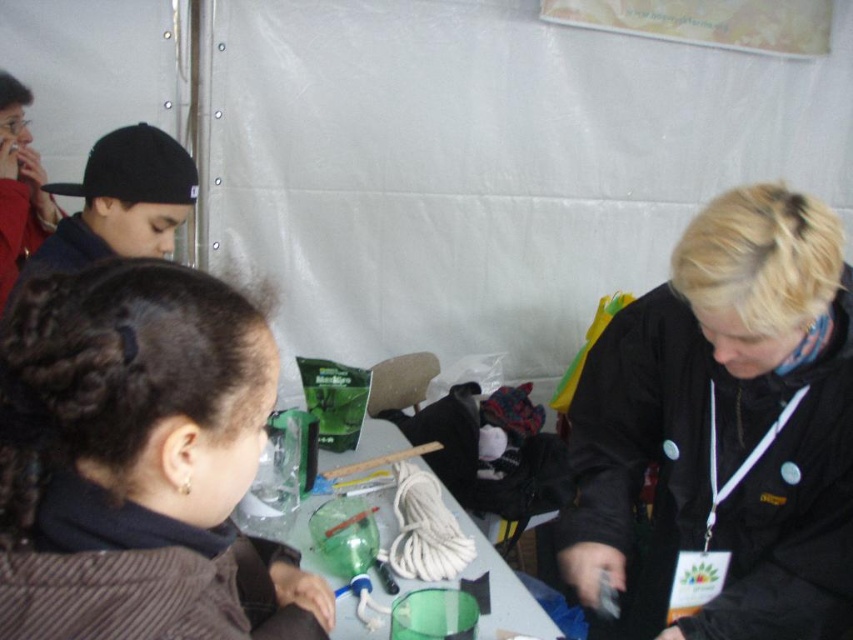
You are organizing a fashion show and need to display the black matte jacket at upper right and the black matte cap at upper left. Which item will require more horizontal space when placed side by side on a display stand?

The black matte jacket at upper right requires more horizontal space because its width surpasses that of the black matte cap at upper left.

You are at the event and want to grab both the black matte cap at upper left and the matte red jacket at upper left. Which one is closer to your right hand if you are facing the scene?

The black matte cap at upper left is to the right of matte red jacket at upper left, so if you are facing the scene, the black matte cap at upper left is closer to your right hand.

You are an observer looking at the scene. There is a black matte jacket at upper right and a black matte cap at upper left. Which object is located lower in the image?

The black matte jacket at upper right is positioned under the black matte cap at upper left, so the jacket is lower than the cap.